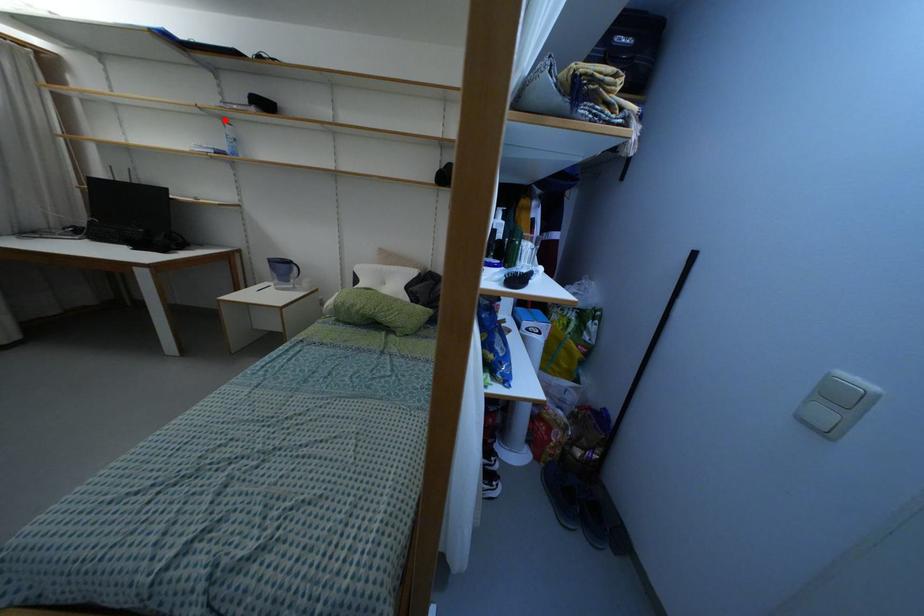
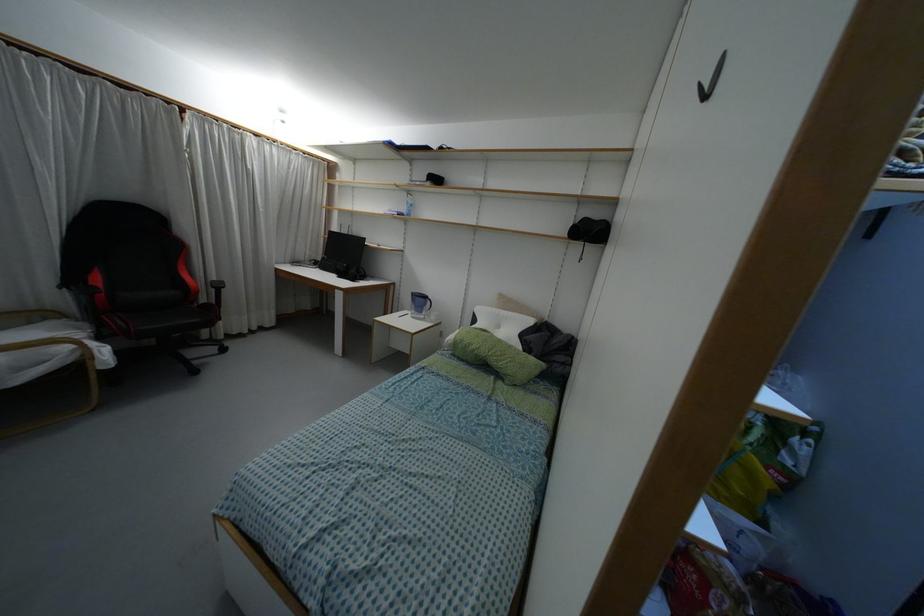
In the second image, find the point that corresponds to the highlighted location in the first image.

(407, 192)